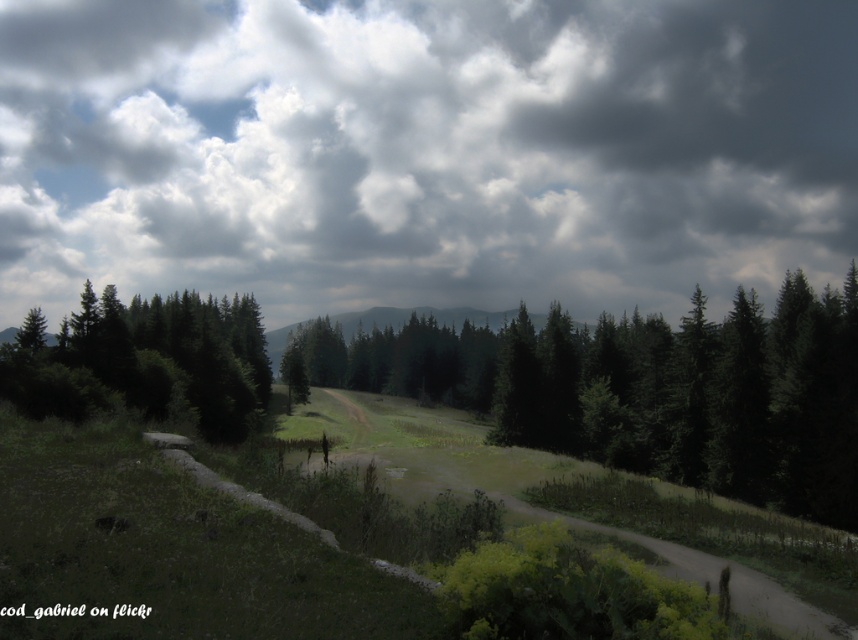
Is cloudy sky at upper center positioned behind green matte tree at center?

Yes, it is.

Is point (125, 241) positioned before point (822, 499)?

That is False.

Does point (183, 250) come closer to viewer compared to point (572, 401)?

No, (183, 250) is further to viewer.

Where is `cloudy sky at upper center`? cloudy sky at upper center is located at coordinates (424, 150).

Is the position of green matte tree at center more distant than that of green matte trees at center?

That is True.

Is green matte tree at center wider than green matte trees at center?

Yes.

Is point (795, 323) less distant than point (212, 435)?

Yes.

Identify the location of green matte tree at center. (647, 388).

Who is shorter, cloudy sky at upper center or green matte trees at center?

With less height is green matte trees at center.

Does cloudy sky at upper center have a lesser width compared to green matte trees at center?

No.

Does point (633, 60) come behind point (188, 353)?

Yes, it is.

You are a GUI agent. You are given a task and a screenshot of the screen. Output one action in this format:
    pyautogui.click(x=<x>, y=<y>)
    Task: Click on the cloudy sky at upper center
    
    Given the screenshot: What is the action you would take?
    pyautogui.click(x=424, y=150)